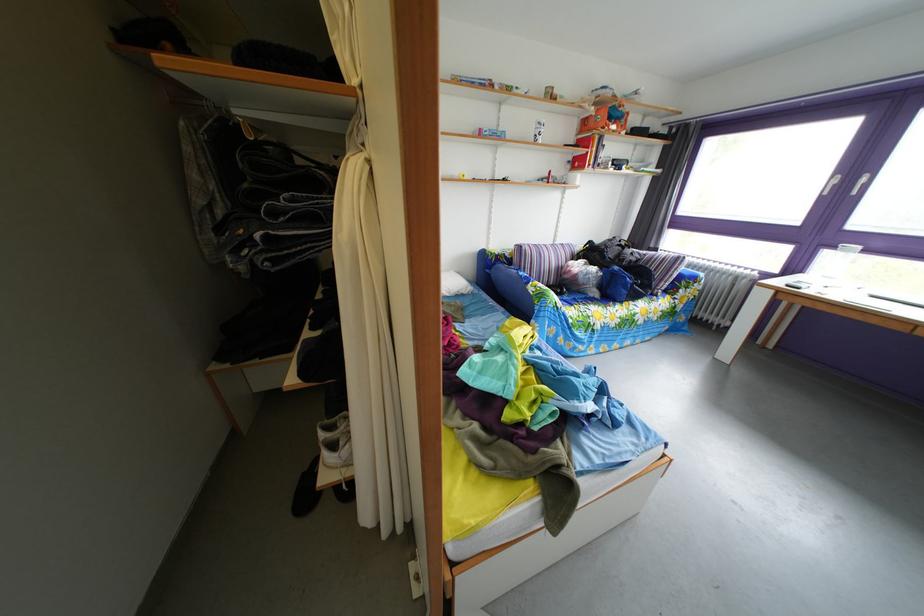
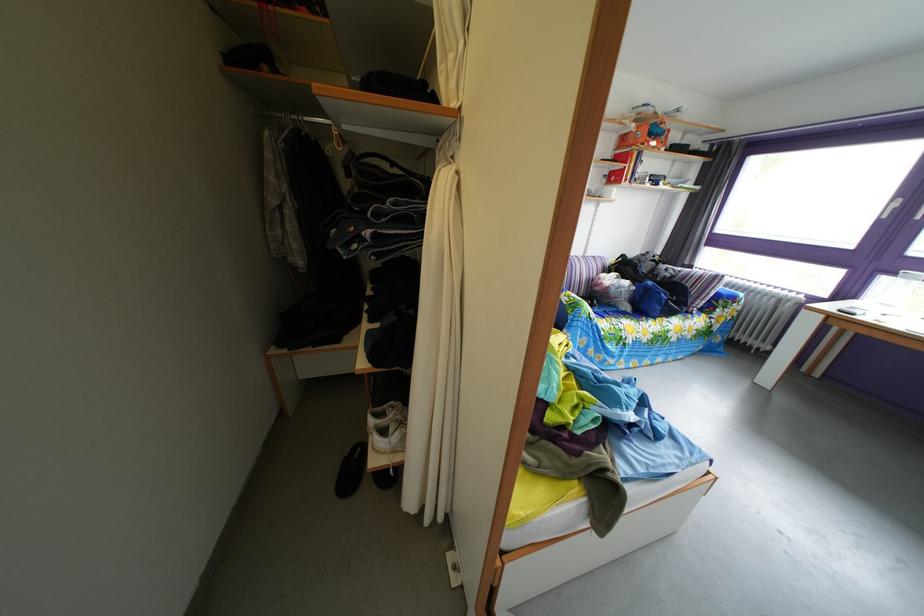
The point at (605,302) is marked in the first image. Where is the corresponding point in the second image?

(638, 315)